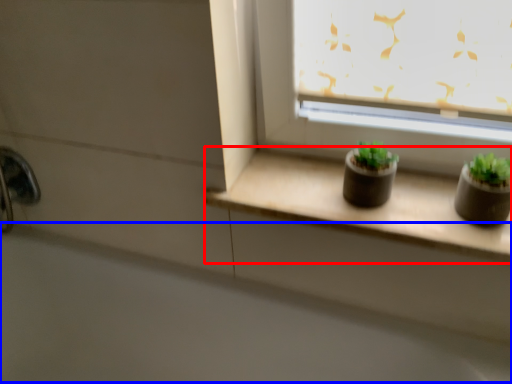
Question: Among these objects, which one is farthest to the camera, window sill (highlighted by a red box) or bath (highlighted by a blue box)?

Choices:
 (A) window sill
 (B) bath

Answer: (A)